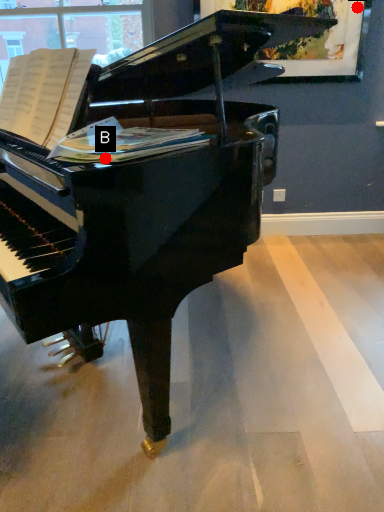
Question: Two points are circled on the image, labeled by A and B beside each circle. Which point is closer to the camera?

Choices:
 (A) A is closer
 (B) B is closer

Answer: (B)